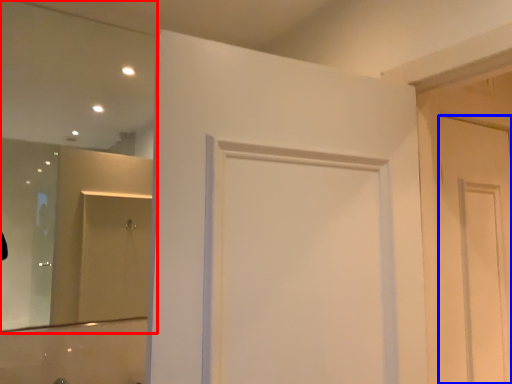
Question: Which object is further to the camera taking this photo, mirror (highlighted by a red box) or door (highlighted by a blue box)?

Choices:
 (A) mirror
 (B) door

Answer: (B)